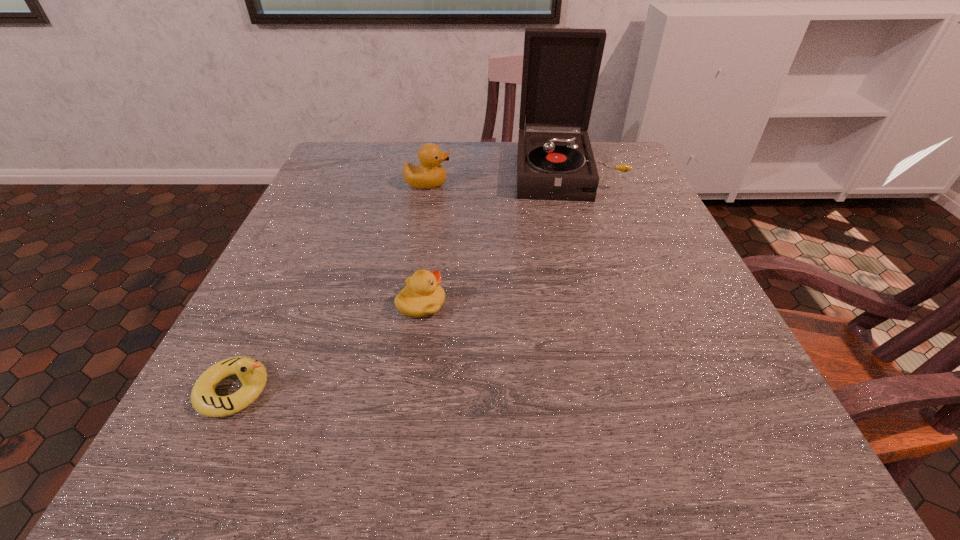
Find the location of a particular element. This screenshot has height=540, width=960. free space at the far left corner of the desktop is located at coordinates (322, 177).

Identify the location of free spot at the near left corner of the desktop. The image size is (960, 540). (195, 475).

Identify the location of vacant region at the far right corner. (617, 161).

Image resolution: width=960 pixels, height=540 pixels. I want to click on free point between the third farthest object and the leftmost object, so click(x=328, y=347).

Locate an element on the screen. This screenshot has height=540, width=960. empty space between the second nearest duckling and the phonograph record is located at coordinates (493, 238).

Where is `free spot between the tallest duckling and the second nearest object`? This screenshot has height=540, width=960. free spot between the tallest duckling and the second nearest object is located at coordinates (424, 244).

Locate an element on the screen. free space between the second nearest duckling and the nearest duckling is located at coordinates (328, 347).

Locate an element on the screen. vacant space that's between the third farthest object and the phonograph record is located at coordinates (493, 238).

At what (x,y) coordinates should I click in order to perform the action: click on free space between the farthest duckling and the phonograph record. Please return your answer as a coordinate pair (x, y). The width and height of the screenshot is (960, 540). Looking at the image, I should click on 496,178.

At what (x,y) coordinates should I click in order to perform the action: click on vacant space that is in between the tallest duckling and the nearest object. Please return your answer as a coordinate pair (x, y). The width and height of the screenshot is (960, 540). Looking at the image, I should click on (331, 287).